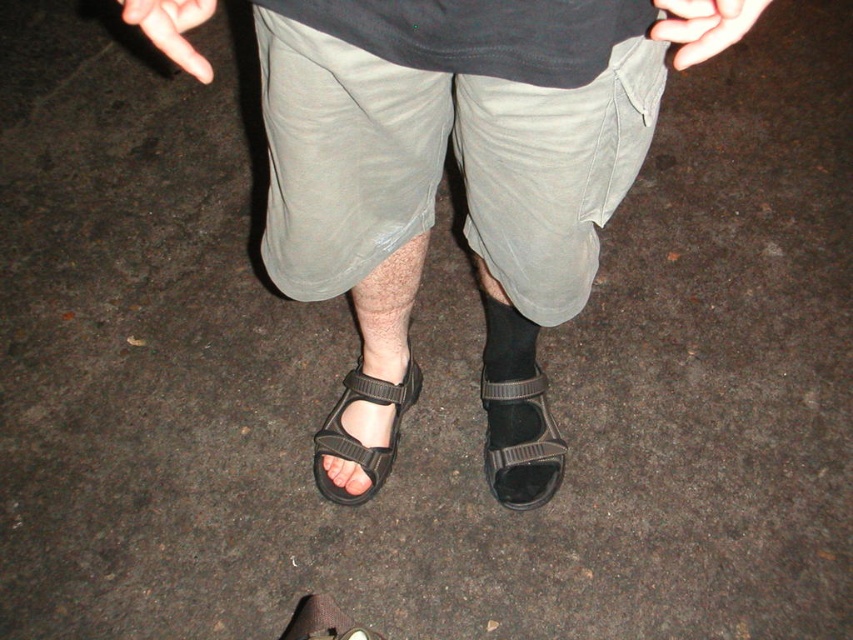
Based on the scene description, can you determine the spatial relationship between the light gray cotton shorts at center and the black rubber sandal at lower center?

The light gray cotton shorts at center are positioned above the black rubber sandal at lower center.